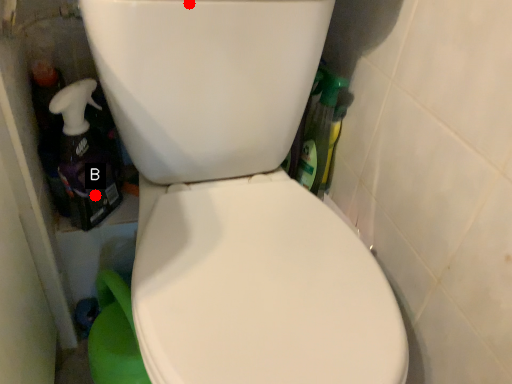
Question: Two points are circled on the image, labeled by A and B beside each circle. Which point is closer to the camera?

Choices:
 (A) A is closer
 (B) B is closer

Answer: (A)